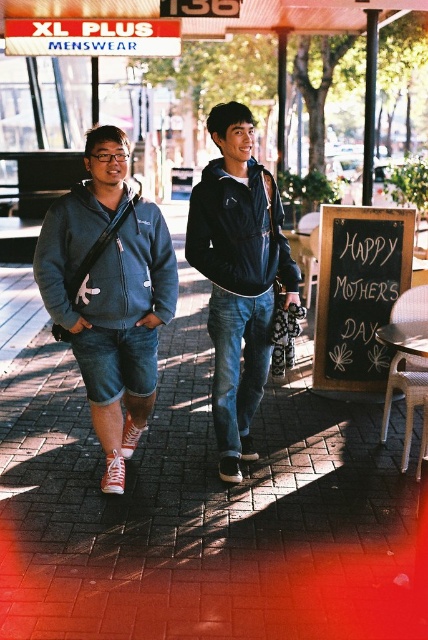
You are a customer looking for a hoodie and a sweatshirt in the XL PLUS MENSWEAR store. You see the matte blue hoodie at center and the matte blue sweatshirt at left. Which item is positioned lower in the store window?

The matte blue hoodie at center is located below the matte blue sweatshirt at left, so the matte blue hoodie at center is positioned lower in the store window.

You are a delivery person who needs to place the dark blue hoodie at center and the black chalkboard at lower right into a storage container. The container can only hold items that are smaller than 1 meter in any dimension. Based on the scene, will both items fit?

The dark blue hoodie at center is bigger than black chalkboard at lower right. Since the hoodie is larger, it might exceed the 1 meter limit. However, without exact measurements, we can only infer that the hoodie is larger than the chalkboard. If the hoodie is under 1 meter in all dimensions, both would fit, but if it exceeds, neither would. The description only states relative size, not absolute.